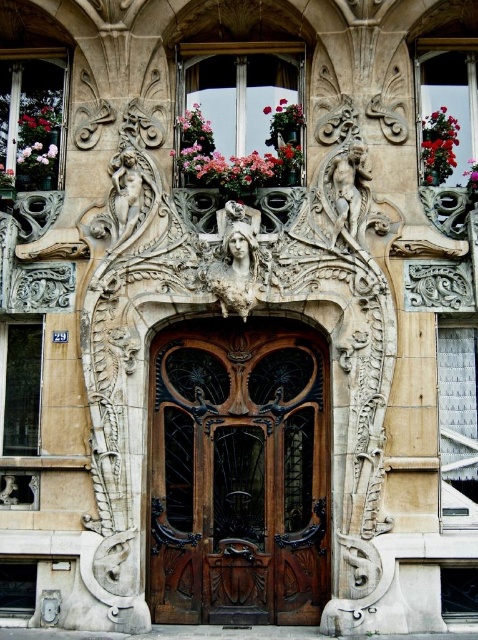
Question: Is dark brown wood door at center to the left of matte gray metal window at lower left from the viewer's perspective?

Choices:
 (A) yes
 (B) no

Answer: (B)

Question: Among these points, which one is farthest from the camera?

Choices:
 (A) (349, 170)
 (B) (60, 172)
 (C) (140, 188)

Answer: (B)

Question: Which object appears closest to the camera in this image?

Choices:
 (A) white stone nude figure at center
 (B) transparent glass window at lower right
 (C) clear glass window at center
 (D) dark brown wood door at center

Answer: (B)

Question: Which object is the closest to the matte gray metal window at lower left?

Choices:
 (A) white stone statue at center
 (B) matte glass window at upper left
 (C) white stone nude figure at center

Answer: (A)

Question: Does red flowerpot at upper right have a lesser width compared to pink matte flower at center?

Choices:
 (A) yes
 (B) no

Answer: (B)

Question: Does matte glass window at upper left lie behind clear glass window at lower left?

Choices:
 (A) yes
 (B) no

Answer: (A)